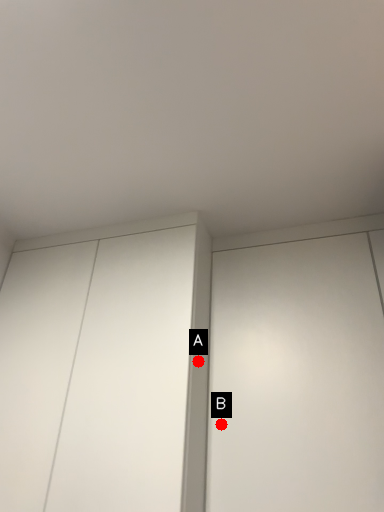
Question: Two points are circled on the image, labeled by A and B beside each circle. Which point is farther from the camera taking this photo?

Choices:
 (A) A is further
 (B) B is further

Answer: (A)